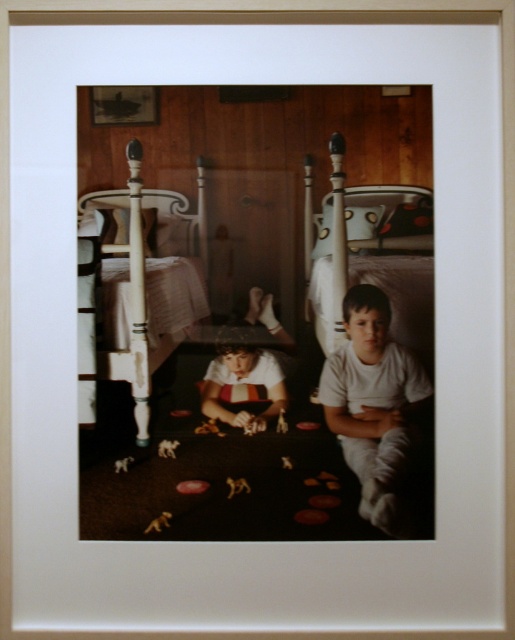
You are a photographer trying to capture a closeup of the white plastic toy at center without including the white cotton shirt at center in the frame. Based on their positions, is this possible?

The white cotton shirt at center is to the right of the white plastic toy at center, so if you position the camera to the left side of the toy, you can capture the toy without including the shirt.

You are a photographer trying to capture a closeup of the white cotton shirt at center without including the white painted wood bed at left in the frame. Given their sizes, is this possible?

The white painted wood bed at left is bigger than the white cotton shirt at center, so it might be challenging to exclude the bed from the frame due to its larger size unless you adjust your camera angle or move closer to the shirt.